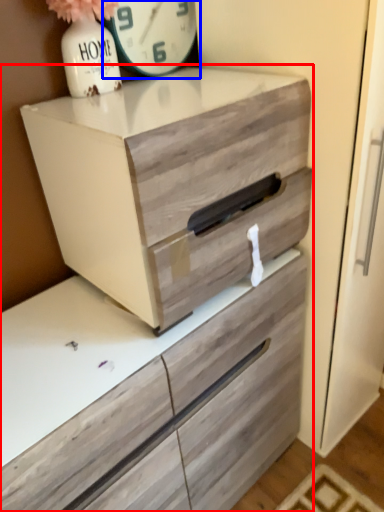
Question: Which object appears closest to the camera in this image, chest of drawers (highlighted by a red box) or clock (highlighted by a blue box)?

Choices:
 (A) chest of drawers
 (B) clock

Answer: (A)